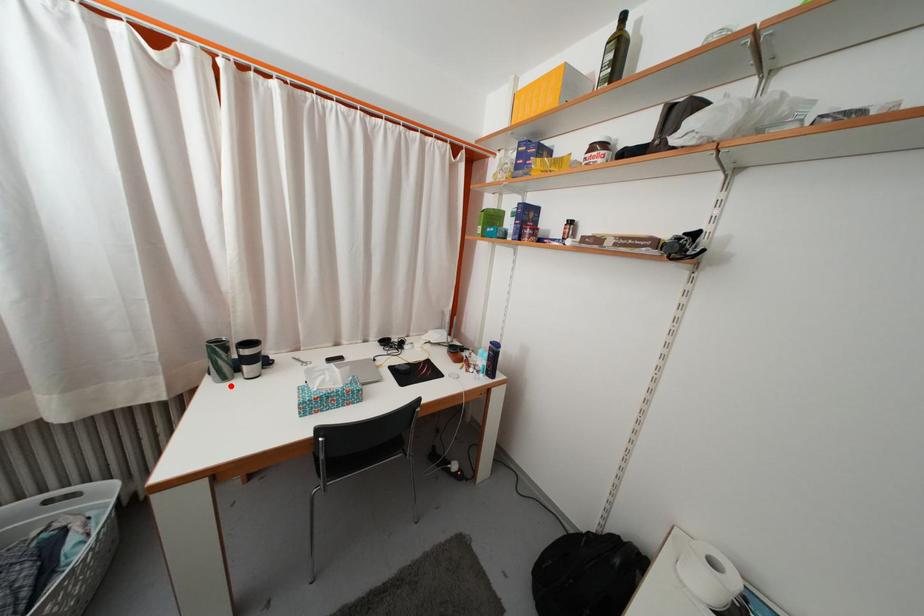
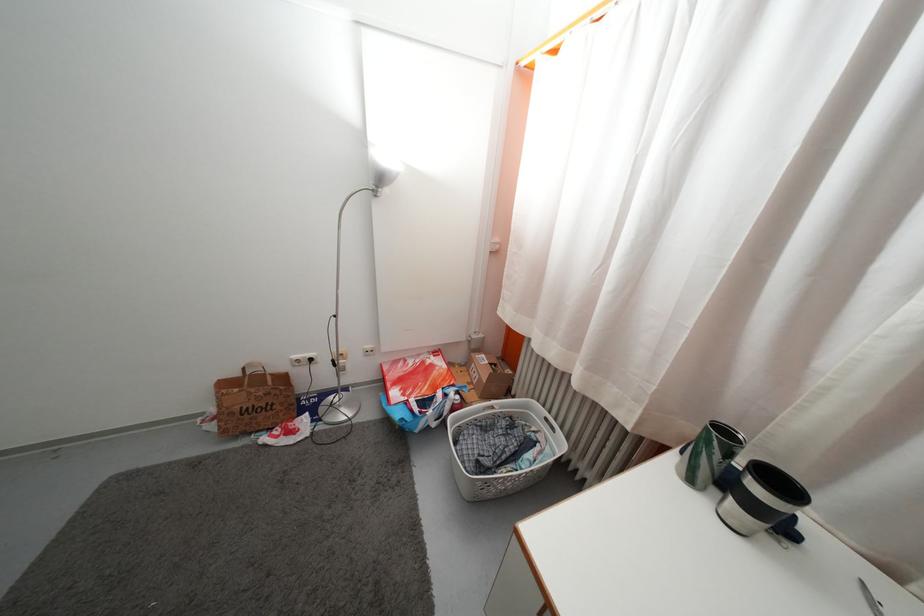
In the second image, find the point that corresponds to the highlighted location in the first image.

(697, 488)